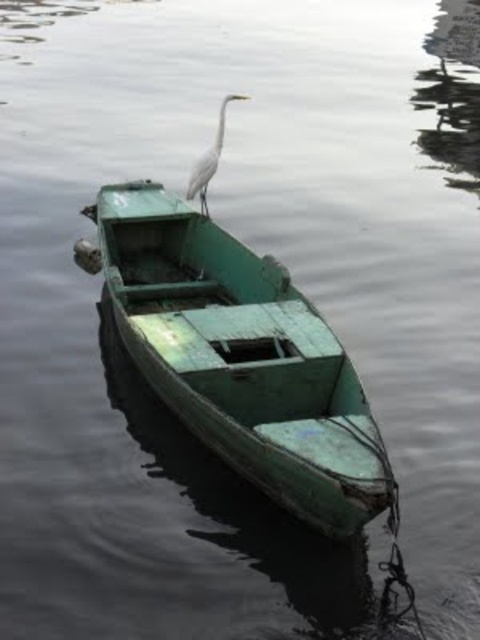
You are an observer standing on the shore looking at the green weathered wood boat at center and the white matte bird at upper center. Which object is positioned higher in the scene?

The white matte bird at upper center is positioned higher than the green weathered wood boat at center because the boat is below the bird.

You are a delivery drone with a wingspan of 2 meters. You need to fly from the green weathered wood boat at center to the white matte bird at upper center. Is your wingspan short enough to avoid collision?

The distance between the green weathered wood boat at center and the white matte bird at upper center is 2.19 meters. Since the drone has a wingspan of 2 meters, it can safely fly between them without collision as the distance is greater than the wingspan.

Looking at this image, you are an observer looking at the scene. There are two points marked on the boat. One is at point (292, 426) and the other is at point (236, 96). Which point is closer to you?

Point (292, 426) is closer to the viewer than point (236, 96).